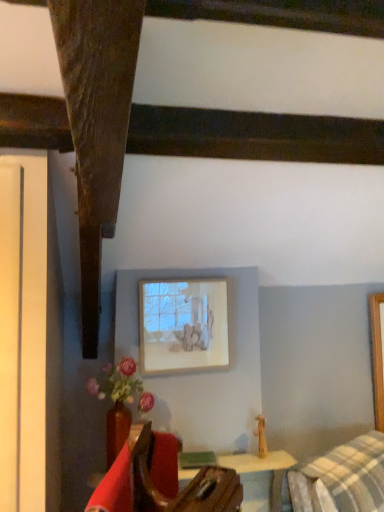
Question: From a real-world perspective, is matte white picture frame at upper center below velvet red armchair at lower left?

Choices:
 (A) yes
 (B) no

Answer: (B)

Question: Is matte white picture frame at upper center positioned with its back to velvet red armchair at lower left?

Choices:
 (A) yes
 (B) no

Answer: (B)

Question: Can you confirm if matte white picture frame at upper center is shorter than velvet red armchair at lower left?

Choices:
 (A) no
 (B) yes

Answer: (A)

Question: Is matte white picture frame at upper center outside velvet red armchair at lower left?

Choices:
 (A) no
 (B) yes

Answer: (B)

Question: From a real-world perspective, is matte white picture frame at upper center over velvet red armchair at lower left?

Choices:
 (A) no
 (B) yes

Answer: (B)

Question: Based on their sizes in the image, would you say matte white picture frame at upper center is bigger or smaller than matte ceramic vase at lower left?

Choices:
 (A) small
 (B) big

Answer: (A)

Question: Would you say matte white picture frame at upper center is to the left or to the right of matte ceramic vase at lower left in the picture?

Choices:
 (A) left
 (B) right

Answer: (B)

Question: From the image's perspective, is matte white picture frame at upper center above or below matte ceramic vase at lower left?

Choices:
 (A) above
 (B) below

Answer: (A)

Question: Is matte white picture frame at upper center inside or outside of matte ceramic vase at lower left?

Choices:
 (A) inside
 (B) outside

Answer: (B)

Question: Considering the relative positions of matte ceramic vase at lower left and velvet red armchair at lower left in the image provided, is matte ceramic vase at lower left to the left or to the right of velvet red armchair at lower left?

Choices:
 (A) left
 (B) right

Answer: (A)

Question: Is point (137, 384) closer or farther from the camera than point (137, 476)?

Choices:
 (A) closer
 (B) farther

Answer: (B)

Question: In terms of size, does matte ceramic vase at lower left appear bigger or smaller than velvet red armchair at lower left?

Choices:
 (A) big
 (B) small

Answer: (B)

Question: Relative to velvet red armchair at lower left, is matte ceramic vase at lower left in front or behind?

Choices:
 (A) behind
 (B) front

Answer: (A)

Question: Considering the positions of velvet red armchair at lower left and matte ceramic vase at lower left in the image, is velvet red armchair at lower left wider or thinner than matte ceramic vase at lower left?

Choices:
 (A) wide
 (B) thin

Answer: (B)

Question: From the image's perspective, is velvet red armchair at lower left located above or below matte ceramic vase at lower left?

Choices:
 (A) below
 (B) above

Answer: (A)